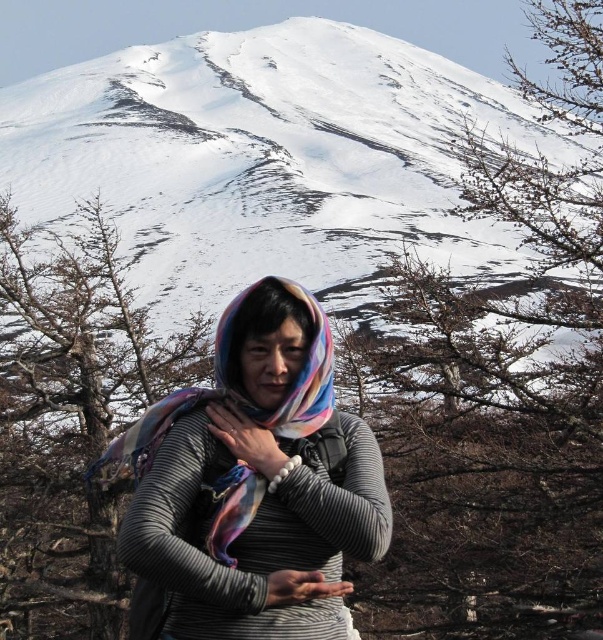
You are a photographer trying to capture the snowy white mountain at upper center in your shot. Based on its position coordinates, where exactly should you aim your camera?

The snowy white mountain at upper center is located at coordinates point (270,160), so aim your camera there to capture it.

You are a photographer planning to take a photo of the snowy white mountain at upper center and the multicolored scarf at center. The camera you are using has a maximum focus range of 100 meters. Will both subjects be in focus simultaneously?

The snowy white mountain at upper center and multicolored scarf at center are 107.63 meters apart from each other. Since the camera can only focus up to 100 meters, the distance between them exceeds the focus range, so both subjects cannot be in focus at the same time.